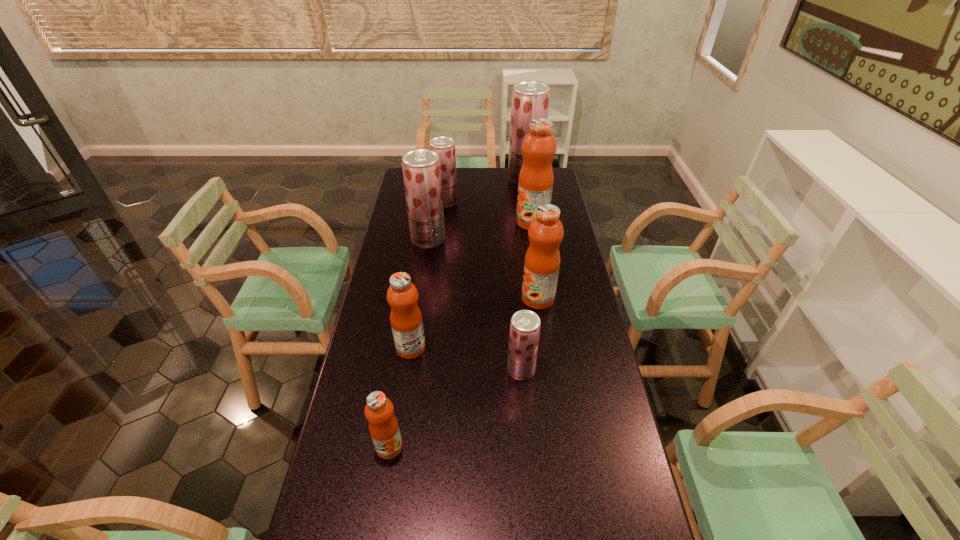
At what (x,y) coordinates should I click in order to perform the action: click on free region located 0.160m on the left of the second farthest strawberry fruit juice. Please return your answer as a coordinate pair (x, y). The image size is (960, 540). Looking at the image, I should click on (398, 202).

Identify the location of vacant space located on the front label of the second smallest orange fruit juice. The height and width of the screenshot is (540, 960). (454, 348).

The width and height of the screenshot is (960, 540). In order to click on free point located on the back of the nearest strawberry fruit juice in this screenshot , I will do `click(516, 304)`.

I want to click on vacant space located on the front label of the nearest orange fruit juice, so click(x=377, y=523).

Where is `object that is at the far edge`? The image size is (960, 540). object that is at the far edge is located at coordinates (530, 99).

Where is `object present at the far right corner`? Image resolution: width=960 pixels, height=540 pixels. object present at the far right corner is located at coordinates (530, 99).

In the image, there is a desktop. Where is `vacant space at the far edge`? Image resolution: width=960 pixels, height=540 pixels. vacant space at the far edge is located at coordinates (x=463, y=187).

In the image, there is a desktop. Where is `vacant space at the left edge`? The height and width of the screenshot is (540, 960). vacant space at the left edge is located at coordinates (335, 443).

The image size is (960, 540). In order to click on vacant space at the right edge of the desktop in this screenshot , I will do `click(628, 471)`.

Find the location of a particular element. vacant space at the far right corner of the desktop is located at coordinates (554, 169).